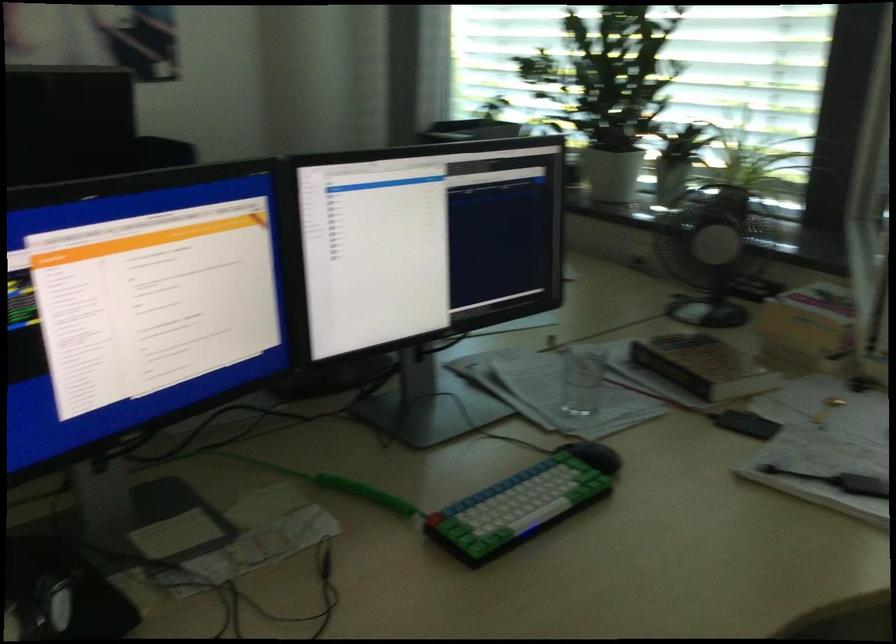
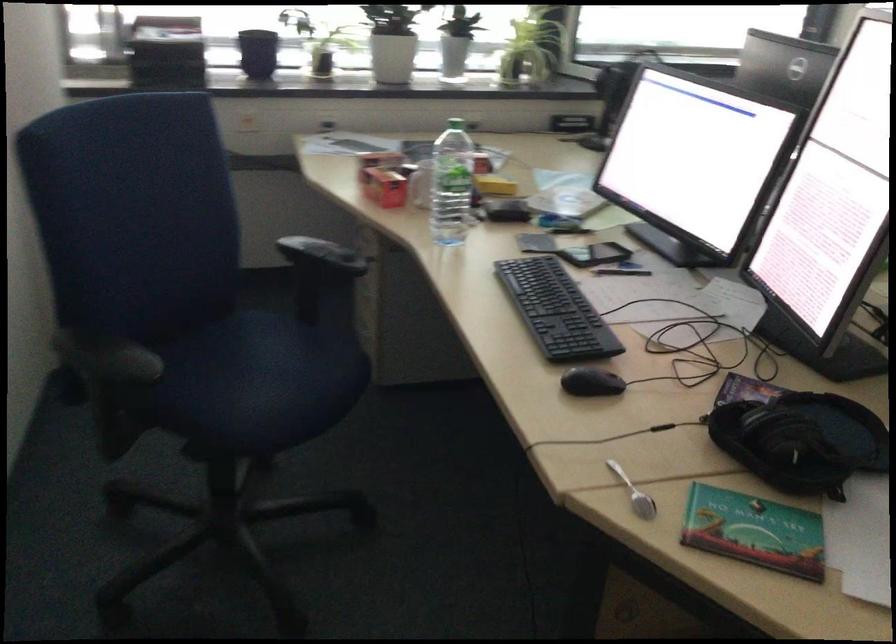
In the second image, find the point that corresponds to (x=564, y=158) in the first image.

(257, 53)